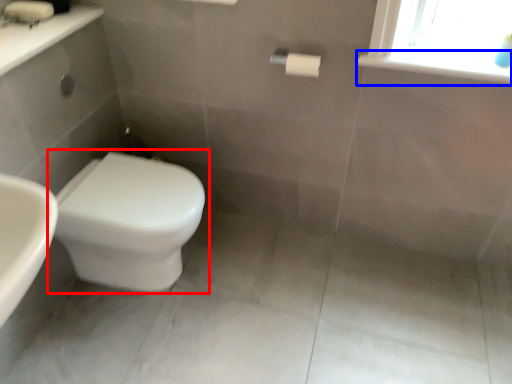
Question: Which object appears closest to the camera in this image, toilet (highlighted by a red box) or window sill (highlighted by a blue box)?

Choices:
 (A) toilet
 (B) window sill

Answer: (B)